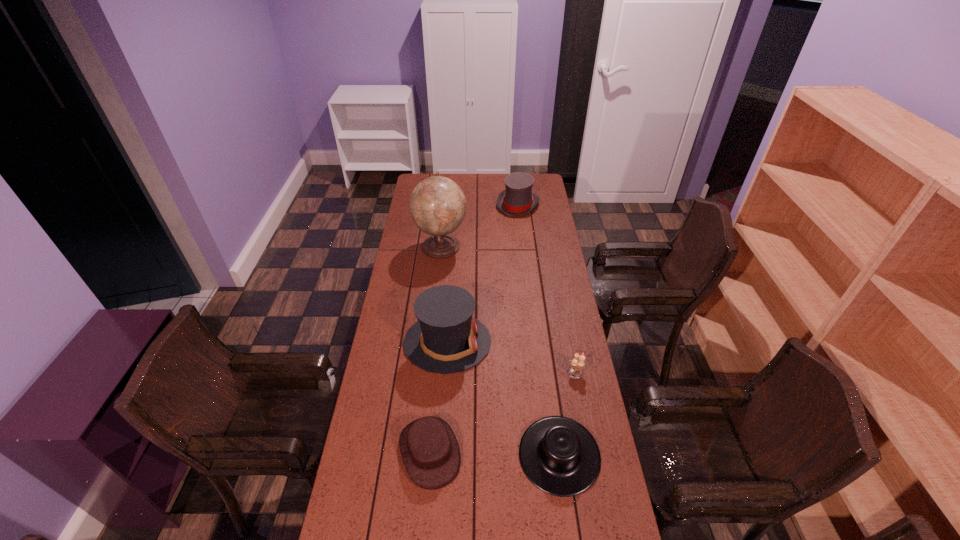
This screenshot has width=960, height=540. What are the coordinates of `the tallest object` in the screenshot? It's located at (437, 204).

The width and height of the screenshot is (960, 540). Identify the location of globe. (437, 204).

The width and height of the screenshot is (960, 540). I want to click on the fifth shortest object, so click(446, 339).

Find the location of a particular element. the second farthest hat is located at coordinates (446, 339).

Identify the location of the farthest object. (518, 199).

Find the location of a particular element. This screenshot has height=540, width=960. the farthest hat is located at coordinates (518, 199).

At what (x,y) coordinates should I click in order to perform the action: click on candle holder. Please return your answer as a coordinate pair (x, y). Looking at the image, I should click on (577, 363).

At what (x,y) coordinates should I click in order to perform the action: click on free region located 0.330m on the front-facing side of the globe. Please return your answer as a coordinate pair (x, y). The image size is (960, 540). Looking at the image, I should click on (535, 246).

The width and height of the screenshot is (960, 540). What are the coordinates of `vacant area situated with goggles on the front of the fifth shortest object` in the screenshot? It's located at (570, 342).

Where is `free space located on the front of the farthest hat`? This screenshot has width=960, height=540. free space located on the front of the farthest hat is located at coordinates (520, 224).